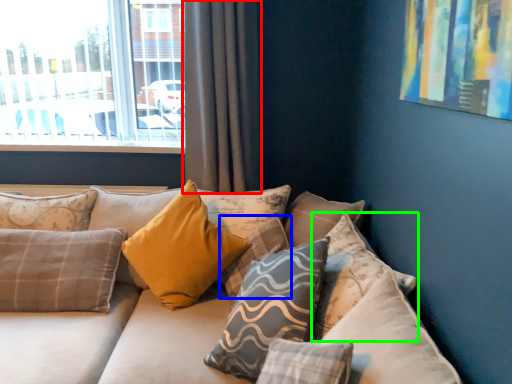
Question: Considering the real-world distances, which object is closest to curtain (highlighted by a red box)? pillow (highlighted by a blue box) or pillow (highlighted by a green box).

Choices:
 (A) pillow
 (B) pillow

Answer: (A)